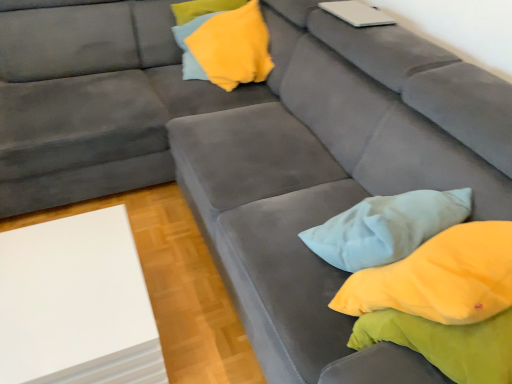
Question: In terms of height, does yellow fabric pillow at upper center look taller or shorter compared to white matte board at lower left?

Choices:
 (A) tall
 (B) short

Answer: (B)

Question: Considering the positions of yellow fabric pillow at upper center and white matte board at lower left in the image, is yellow fabric pillow at upper center wider or thinner than white matte board at lower left?

Choices:
 (A) thin
 (B) wide

Answer: (A)

Question: Which of these objects is positioned closest to the white matte board at lower left?

Choices:
 (A) white matte laptop at upper right
 (B) yellow fabric pillow at upper center

Answer: (B)

Question: Which object is the closest to the yellow fabric pillow at upper center?

Choices:
 (A) white matte laptop at upper right
 (B) white matte board at lower left

Answer: (A)